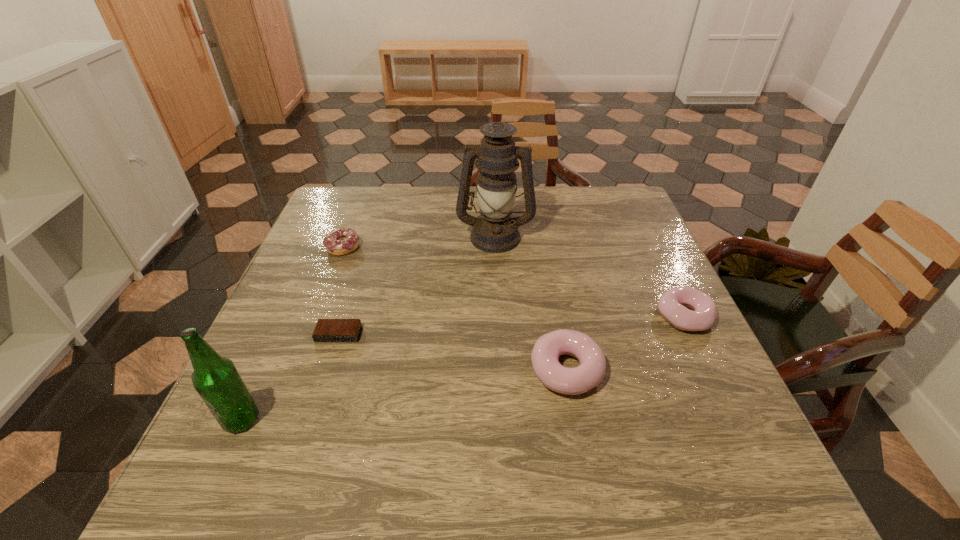
Locate an element on the screen. beer bottle at the left edge is located at coordinates (216, 379).

I want to click on object that is at the right edge, so click(x=672, y=304).

Locate an element on the screen. This screenshot has height=540, width=960. object that is at the near left corner is located at coordinates (216, 379).

In the image, there is a desktop. Where is `free region at the far edge`? This screenshot has width=960, height=540. free region at the far edge is located at coordinates (378, 213).

Locate an element on the screen. vacant space at the near edge of the desktop is located at coordinates (515, 416).

At what (x,y) coordinates should I click in order to perform the action: click on vacant space at the left edge of the desktop. Please return your answer as a coordinate pair (x, y). The image size is (960, 540). Looking at the image, I should click on (293, 289).

Locate an element on the screen. This screenshot has width=960, height=540. free space at the right edge of the desktop is located at coordinates (651, 243).

This screenshot has width=960, height=540. Identify the location of free space at the far left corner of the desktop. (371, 224).

Where is `vacant area at the far right corner of the desktop`? vacant area at the far right corner of the desktop is located at coordinates (596, 225).

Where is `free spot at the near right corner of the desktop`? free spot at the near right corner of the desktop is located at coordinates (656, 423).